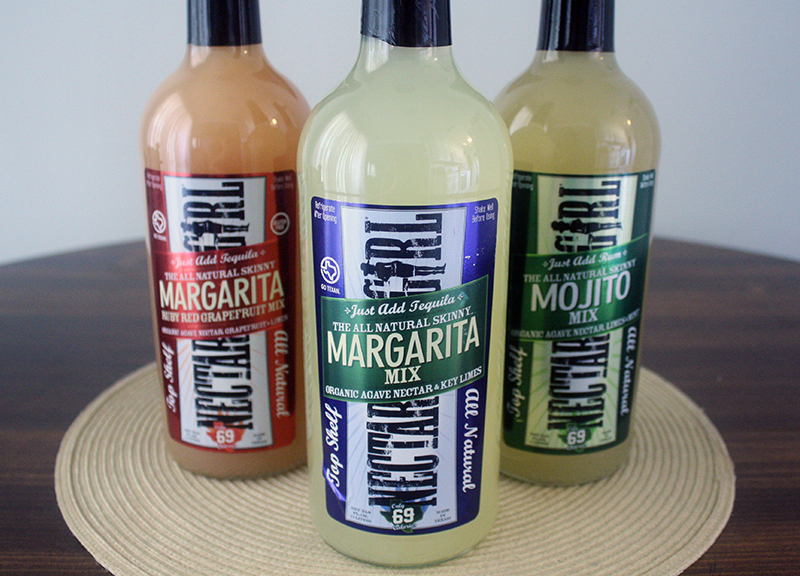
In order to click on bottle in this screenshot , I will do `click(230, 109)`.